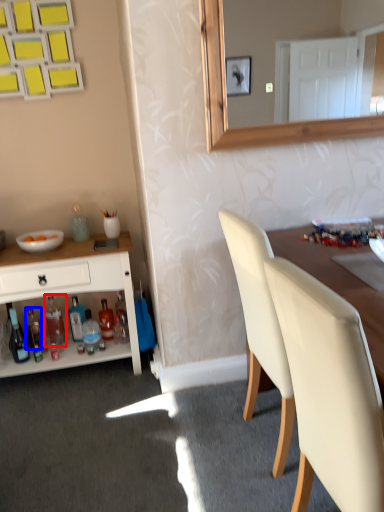
Question: Which point is further to the camera, bottle (highlighted by a red box) or bottle (highlighted by a blue box)?

Choices:
 (A) bottle
 (B) bottle

Answer: (B)